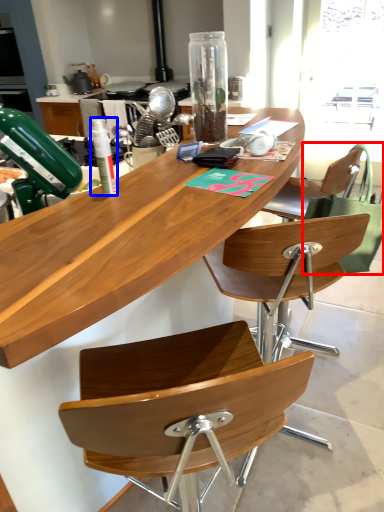
Question: Which point is closer to the camera, handbag (highlighted by a red box) or bottle (highlighted by a blue box)?

Choices:
 (A) handbag
 (B) bottle

Answer: (B)